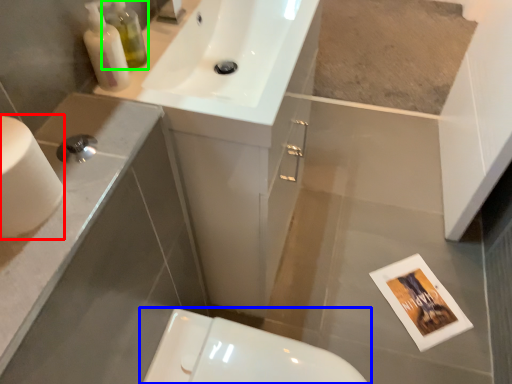
Question: Based on their relative distances, which object is nearer to toilet paper (highlighted by a red box)? Choose from toilet (highlighted by a blue box) and toiletry (highlighted by a green box).

Choices:
 (A) toilet
 (B) toiletry

Answer: (B)